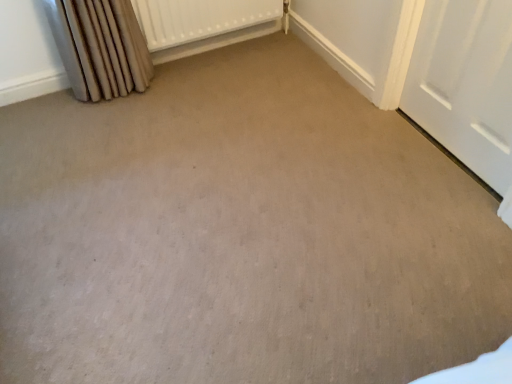
Identify the location of vacant region in front of white matte door at right. (442, 203).